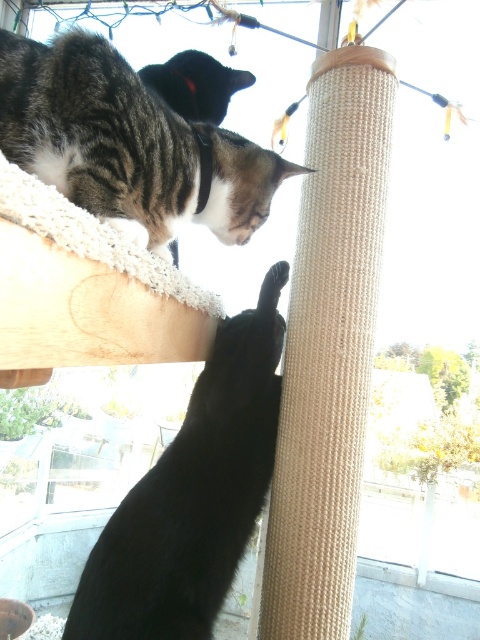
You are a cat owner who wants to place a new toy between the black matte cat at upper left and the tabby fur cat at upper left. Where should you place the toy to ensure it is between them?

The black matte cat at upper left is positioned on the right side of the tabby fur cat at upper left, so placing the toy between them would require placing it to the right of the tabby fur cat at upper left and to the left of the black matte cat at upper left.

You are a cat owner trying to locate your pets. You see a black matte cat at upper left and a tabby fur cat at upper left. Which cat is positioned lower in the image?

The black matte cat at upper left is located below the tabby fur cat at upper left, so the black matte cat at upper left is positioned lower in the image.

You are a cat owner who wants to ensure your cats have enough vertical space. Looking at the image, which cat, the black matte cat at upper left or the tabby fur cat at upper left, requires more vertical space based on their size?

The black matte cat at upper left requires more vertical space because it is taller than the tabby fur cat at upper left.